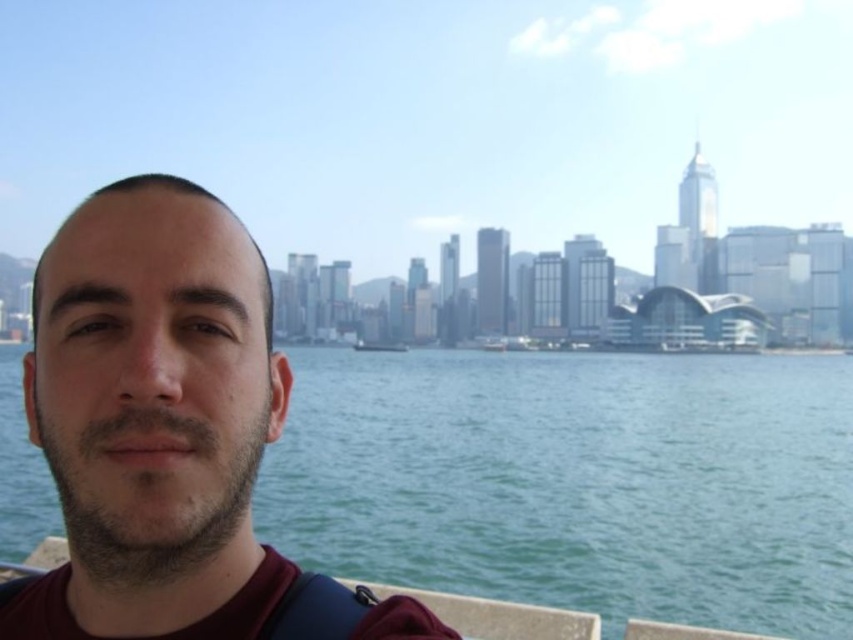
You are a photographer trying to capture the entire scene in one shot. Given that your camera can only focus on objects within a 100 cm width, and you need to ensure both the green water at center and the matte black face at left are in focus, can you determine if both will fit within the camera frame?

The green water at center might be wider than matte black face at left, so the total width required to include both could exceed the camera frame limit of 100 cm. It is uncertain if both will fit without further measurement.

You are a photographer trying to capture a photo of the matte black face at left and the wooden sailboat at center. Based on their sizes in the image, which one would appear larger in your photo?

The matte black face at left appears larger in the photo because it has a greater height compared to the wooden sailboat at center.